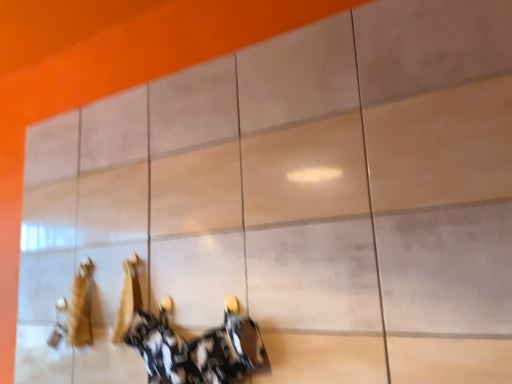
Locate an element on the screen. This screenshot has width=512, height=384. camouflage fabric shoe at center is located at coordinates (189, 342).

Image resolution: width=512 pixels, height=384 pixels. What do you see at coordinates (189, 342) in the screenshot?
I see `camouflage fabric shoe at center` at bounding box center [189, 342].

Where is `camouflage fabric shoe at center`? Image resolution: width=512 pixels, height=384 pixels. camouflage fabric shoe at center is located at coordinates (189, 342).